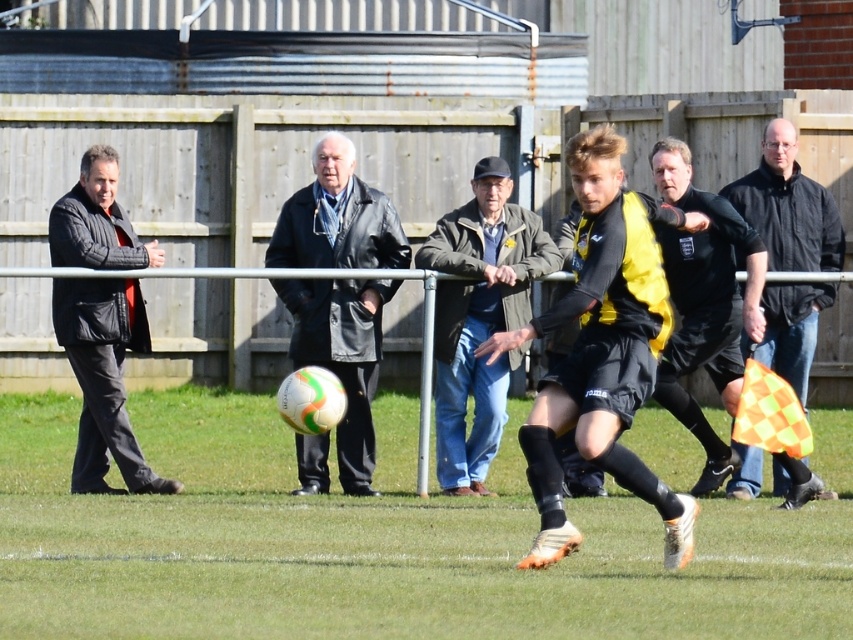
Question: Estimate the real-world distances between objects in this image. Which object is closer to the black quilted jacket at left?

Choices:
 (A) black leather jacket at right
 (B) grass at center
 (C) denim jacket at center

Answer: (B)

Question: Is denim jacket at center to the left of black leather jacket at right from the viewer's perspective?

Choices:
 (A) yes
 (B) no

Answer: (A)

Question: Estimate the real-world distances between objects in this image. Which object is farther from the denim jacket at center?

Choices:
 (A) black quilted jacket at left
 (B) black jersey at center

Answer: (A)

Question: Can you confirm if denim jacket at center is bigger than black leather jacket at right?

Choices:
 (A) no
 (B) yes

Answer: (A)

Question: Can you confirm if leather jacket at center is thinner than denim jacket at center?

Choices:
 (A) no
 (B) yes

Answer: (B)

Question: Considering the real-world distances, which object is closest to the black quilted jacket at left?

Choices:
 (A) denim jacket at center
 (B) leather jacket at center

Answer: (B)